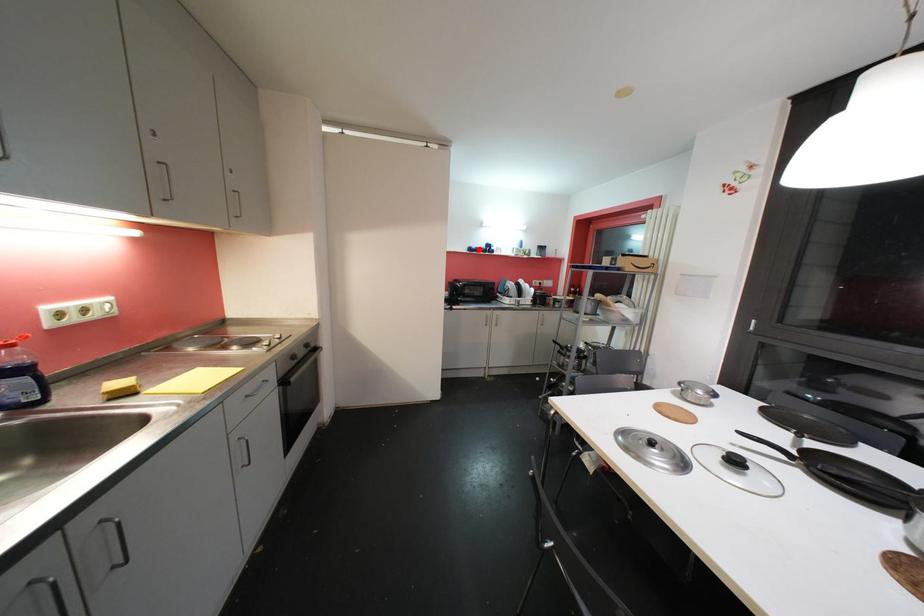
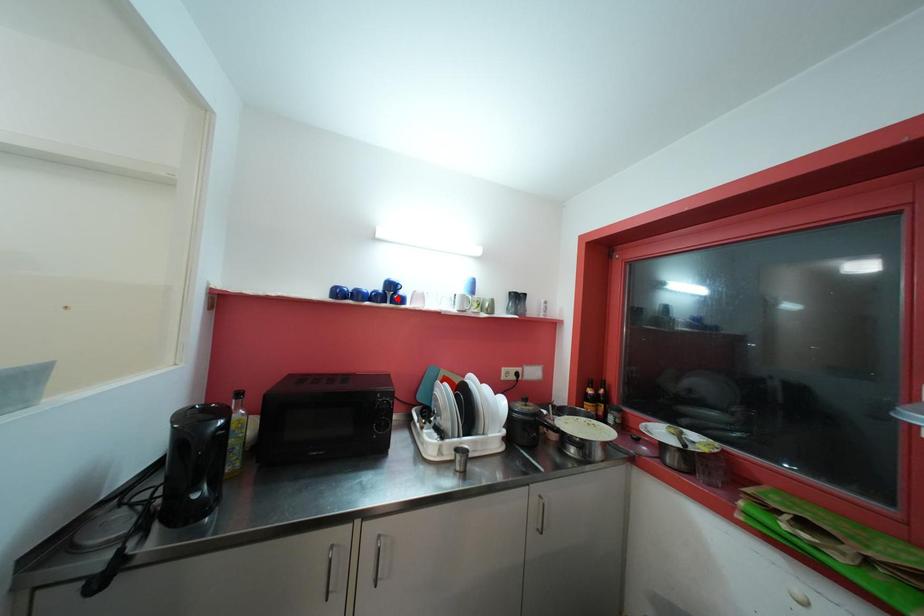
I am providing you with two images of the same scene from different viewpoints. A red point is marked on the first image and another point is marked on the second image. Are the points marked in image1 and image2 representing the same 3D position?

No